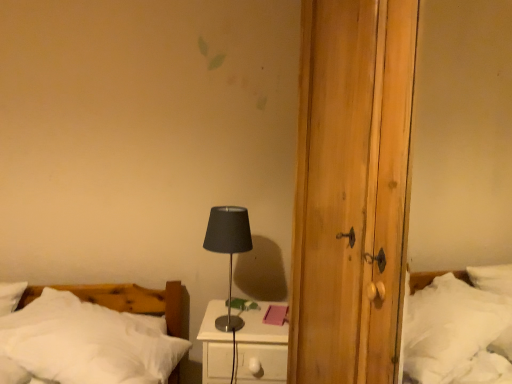
Question: From the image's perspective, is black metallic table lamp at center positioned above or below white soft bed at lower left?

Choices:
 (A) below
 (B) above

Answer: (B)

Question: From a real-world perspective, is black metallic table lamp at center above or below white soft bed at lower left?

Choices:
 (A) above
 (B) below

Answer: (A)

Question: Which is nearer to the white glossy nightstand at center?

Choices:
 (A) white soft bed at lower left
 (B) black metallic table lamp at center

Answer: (A)

Question: Which object is the farthest from the white glossy nightstand at center?

Choices:
 (A) white soft bed at lower left
 (B) black metallic table lamp at center

Answer: (B)